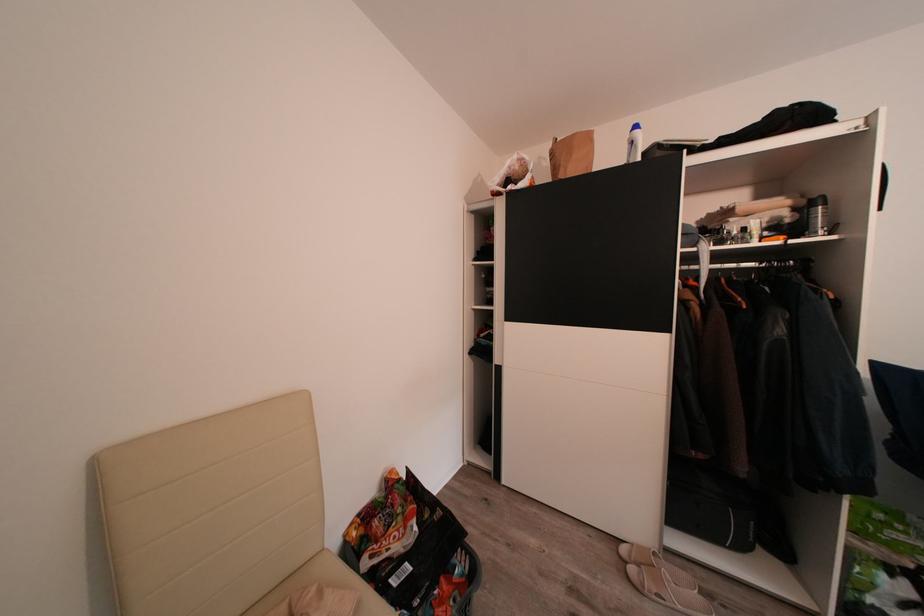
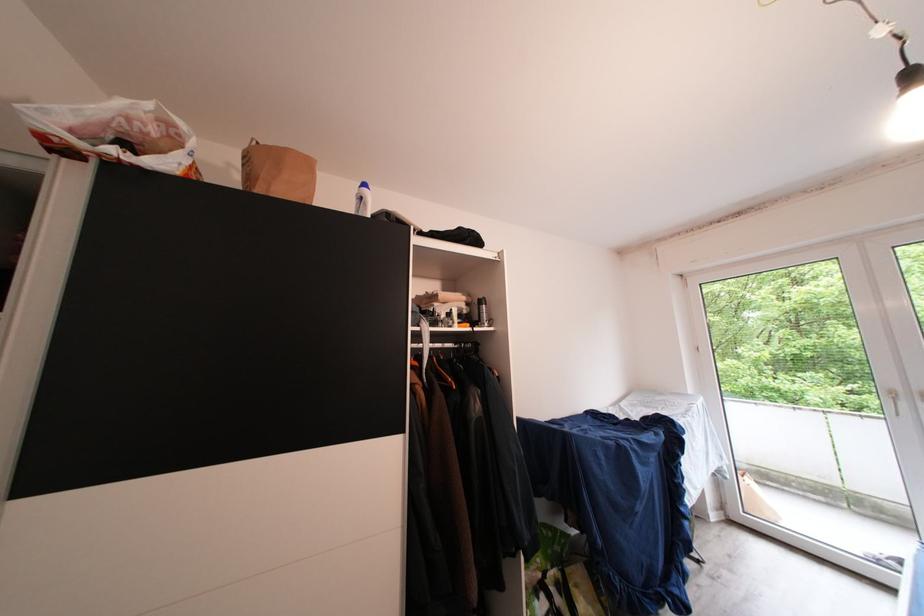
Question: The images are taken continuously from a first-person perspective. In which direction is your viewpoint rotating?

Choices:
 (A) Left
 (B) Right
 (C) Up
 (D) Down

Answer: (B)